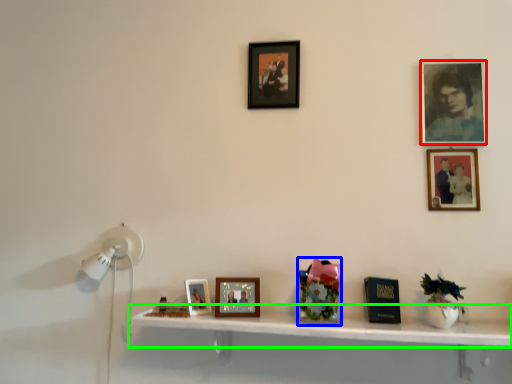
Question: Which is farther away from picture frame (highlighted by a red box)? art (highlighted by a blue box) or shelf (highlighted by a green box)?

Choices:
 (A) art
 (B) shelf

Answer: (B)